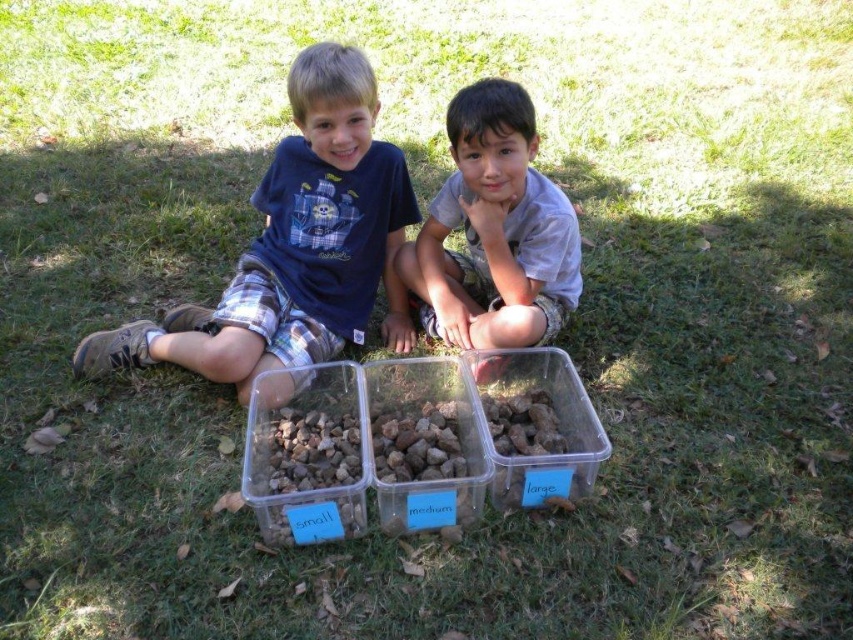
Who is more forward, (x=299, y=323) or (x=532, y=468)?

Point (x=532, y=468) is in front.

Measure the distance between point (299, 68) and camera.

Point (299, 68) and camera are 6.95 feet apart from each other.

Where is `matte blue shirt at center`? matte blue shirt at center is located at coordinates (296, 244).

Does gray cotton shirt at center have a greater height compared to translucent plastic container at center?

Correct, gray cotton shirt at center is much taller as translucent plastic container at center.

Which is more to the right, gray cotton shirt at center or translucent plastic container at center?

Positioned to the right is translucent plastic container at center.

Where is `gray cotton shirt at center`? The image size is (853, 640). gray cotton shirt at center is located at coordinates (494, 230).

Locate an element on the screen. Image resolution: width=853 pixels, height=640 pixels. gray cotton shirt at center is located at coordinates (494, 230).

Between matte blue shirt at center and gray cotton shirt at center, which one appears on the right side from the viewer's perspective?

Positioned to the right is gray cotton shirt at center.

Does point (376, 244) lie behind point (511, 266)?

Yes.

At what (x,y) coordinates should I click in order to perform the action: click on matte blue shirt at center. Please return your answer as a coordinate pair (x, y). The width and height of the screenshot is (853, 640). Looking at the image, I should click on (296, 244).